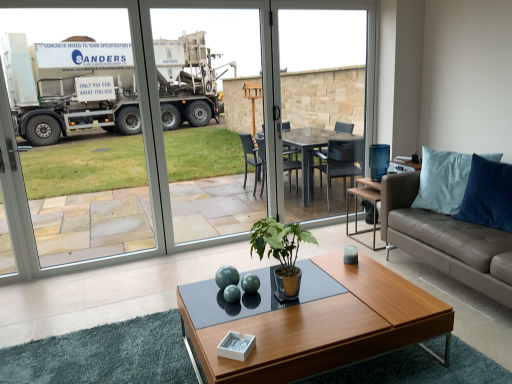
Question: Is wooden coffee table at center taller than blue suede pillow at right?

Choices:
 (A) no
 (B) yes

Answer: (A)

Question: Considering the relative positions of wooden coffee table at center and blue suede pillow at right in the image provided, is wooden coffee table at center to the right of blue suede pillow at right from the viewer's perspective?

Choices:
 (A) yes
 (B) no

Answer: (B)

Question: From the image's perspective, is wooden coffee table at center over blue suede pillow at right?

Choices:
 (A) no
 (B) yes

Answer: (A)

Question: Is wooden coffee table at center looking in the opposite direction of blue suede pillow at right?

Choices:
 (A) no
 (B) yes

Answer: (A)

Question: Is wooden coffee table at center facing towards blue suede pillow at right?

Choices:
 (A) yes
 (B) no

Answer: (B)

Question: Can blue suede pillow at right be found inside wooden coffee table at center?

Choices:
 (A) no
 (B) yes

Answer: (A)

Question: Considering the relative sizes of transparent glass table at center and blue suede pillow at right in the image provided, is transparent glass table at center taller than blue suede pillow at right?

Choices:
 (A) no
 (B) yes

Answer: (B)

Question: From a real-world perspective, is transparent glass table at center on top of blue suede pillow at right?

Choices:
 (A) yes
 (B) no

Answer: (A)

Question: From a real-world perspective, is transparent glass table at center under blue suede pillow at right?

Choices:
 (A) no
 (B) yes

Answer: (A)

Question: Does transparent glass table at center have a lesser width compared to blue suede pillow at right?

Choices:
 (A) no
 (B) yes

Answer: (B)

Question: Can you confirm if transparent glass table at center is wider than blue suede pillow at right?

Choices:
 (A) yes
 (B) no

Answer: (B)

Question: Would you say transparent glass table at center contains blue suede pillow at right?

Choices:
 (A) no
 (B) yes

Answer: (A)

Question: Is transparent glass screen door at center smaller than leather couch at right?

Choices:
 (A) yes
 (B) no

Answer: (A)